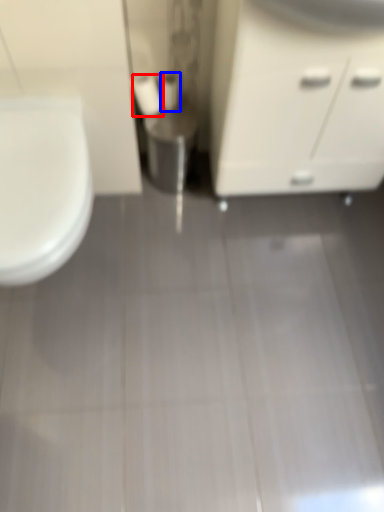
Question: Among these objects, which one is nearest to the camera, toilet paper (highlighted by a red box) or toilet paper (highlighted by a blue box)?

Choices:
 (A) toilet paper
 (B) toilet paper

Answer: (A)